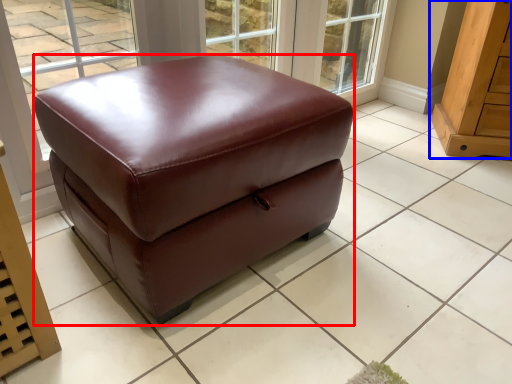
Question: Which object is further to the camera taking this photo, furniture (highlighted by a red box) or furniture (highlighted by a blue box)?

Choices:
 (A) furniture
 (B) furniture

Answer: (B)